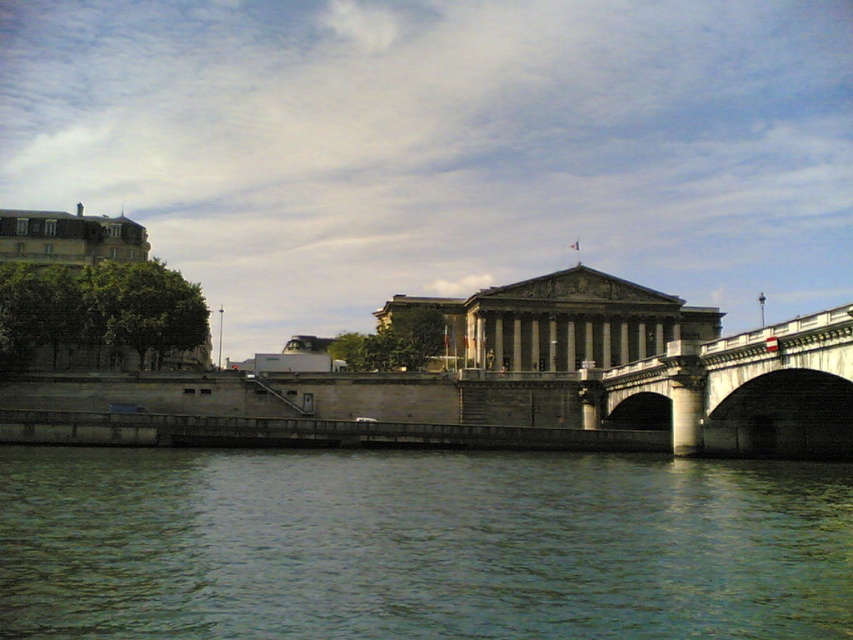
You are standing on the stone embankment and looking towards the grand classical building. There is a point marked at coordinates [419,545]. What does this point indicate?

The point at coordinates [419,545] marks the greenish water at lower center.

You are standing on a boat in the middle of the river and see the greenish water at lower center and the stone bridge at center. Which object is closer to you?

The greenish water at lower center is closer to you because it is in front of the stone bridge at center, meaning it is positioned nearer in the scene.